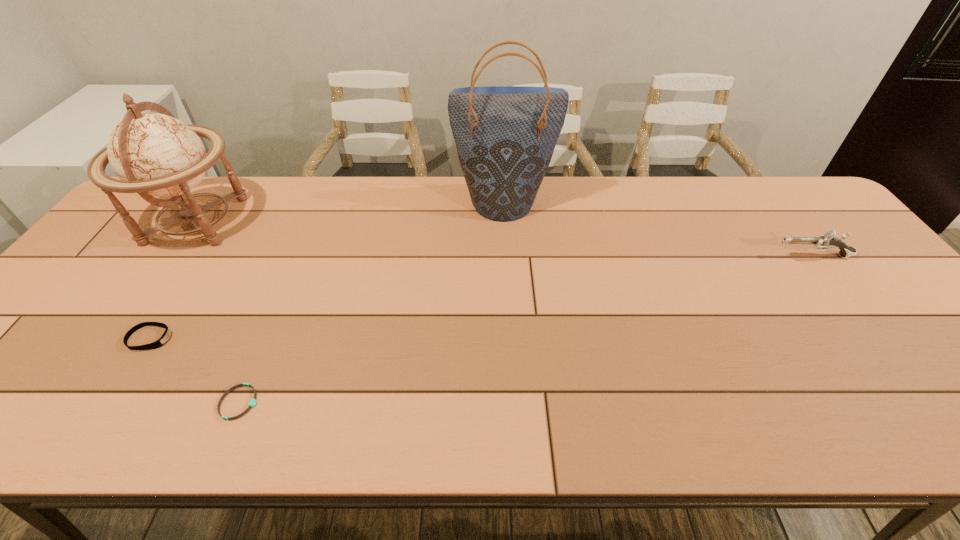
Image resolution: width=960 pixels, height=540 pixels. Identify the location of the fourth object from left to right. [x=505, y=136].

You are a GUI agent. You are given a task and a screenshot of the screen. Output one action in this format:
    pyautogui.click(x=<x>, y=<y>)
    Task: Click on the tallest object
    The width and height of the screenshot is (960, 540).
    Given the screenshot: What is the action you would take?
    pyautogui.click(x=505, y=136)

Image resolution: width=960 pixels, height=540 pixels. Identify the location of globe. coord(154,154).

Identify the location of the third tallest object. Image resolution: width=960 pixels, height=540 pixels. (827, 241).

Find the location of a particular element. The width and height of the screenshot is (960, 540). the rightmost object is located at coordinates (827, 241).

The height and width of the screenshot is (540, 960). I want to click on the second shortest object, so [162, 340].

The width and height of the screenshot is (960, 540). Identify the location of the farther wristband. (162, 340).

Locate an element on the screen. The width and height of the screenshot is (960, 540). the shortest object is located at coordinates coord(253,401).

Where is `the nearest object`? Image resolution: width=960 pixels, height=540 pixels. the nearest object is located at coordinates (253, 401).

Locate an element on the screen. This screenshot has width=960, height=540. vacant point located on the right of the fourth object from left to right is located at coordinates (605, 201).